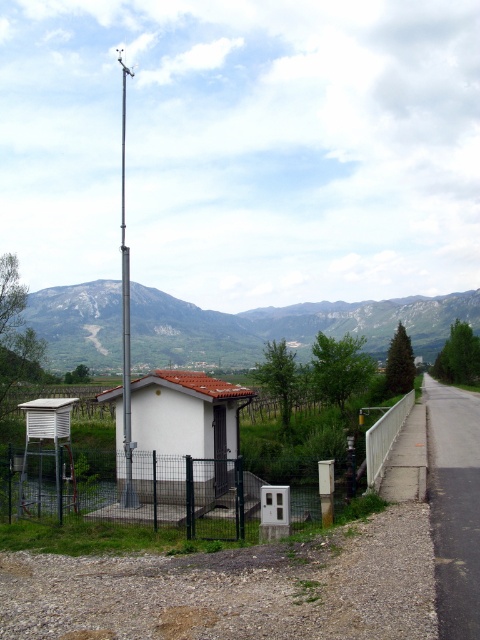
Which is in front, point (245, 490) or point (123, 205)?

Point (245, 490)

Locate an element on the screen. This screenshot has width=480, height=640. metal wire mesh fence at lower center is located at coordinates (146, 493).

Can you confirm if gray rocky mountain at center is shorter than metal wire mesh fence at lower center?

Incorrect, gray rocky mountain at center's height does not fall short of metal wire mesh fence at lower center's.

You are a GUI agent. You are given a task and a screenshot of the screen. Output one action in this format:
    pyautogui.click(x=<x>, y=<y>)
    Task: Click on the gray rocky mountain at center
    
    Given the screenshot: What is the action you would take?
    pyautogui.click(x=285, y=326)

Between point (71, 340) and point (304, 492), which one is positioned in front?

Point (304, 492)

You are a GUI agent. You are given a task and a screenshot of the screen. Output one action in this format:
    pyautogui.click(x=<x>, y=<y>)
    Task: Click on the gray rocky mountain at center
    
    Given the screenshot: What is the action you would take?
    pyautogui.click(x=285, y=326)

Can you confirm if gray rocky mountain at center is wider than silver metallic pole at center?

Indeed, gray rocky mountain at center has a greater width compared to silver metallic pole at center.

From the picture: Is gray rocky mountain at center shorter than silver metallic pole at center?

Yes.

Where is `gray rocky mountain at center`? The height and width of the screenshot is (640, 480). gray rocky mountain at center is located at coordinates (285, 326).